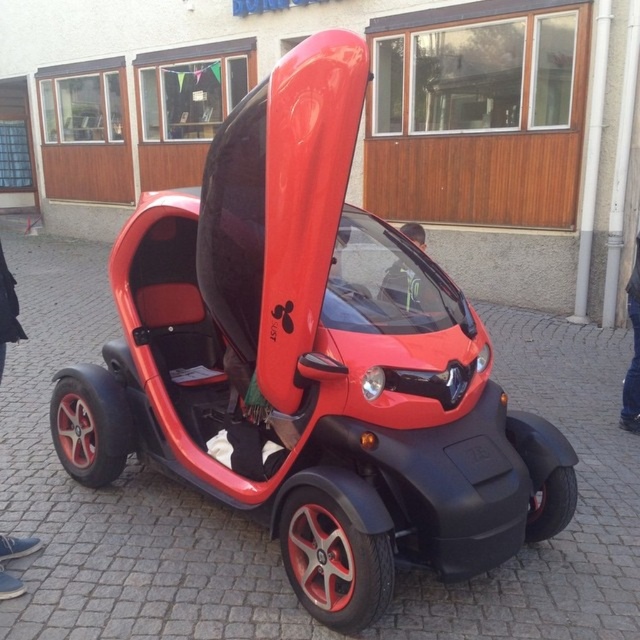
You are a mechanic inspecting the red matte wheel at lower center and the red matte wheel at lower left of the vehicle. Which wheel is closer to the ground?

The red matte wheel at lower center is positioned under the red matte wheel at lower left, meaning it is closer to the ground.

You are standing on the cobblestone street in front of the wooden building and notice the red matte wheel at lower center and the black rubber wheel at lower right. Which wheel is positioned closer to you?

The red matte wheel at lower center is closer to the viewer than the black rubber wheel at lower right.

You are standing in front of the futuristic red vehicle and want to touch two points on it. The first point is at coordinate point(88, 376) and the second is at point(552, 520). Which point is closer to you?

Point(88, 376) is closer to you because it is further to the camera than point(552, 520).